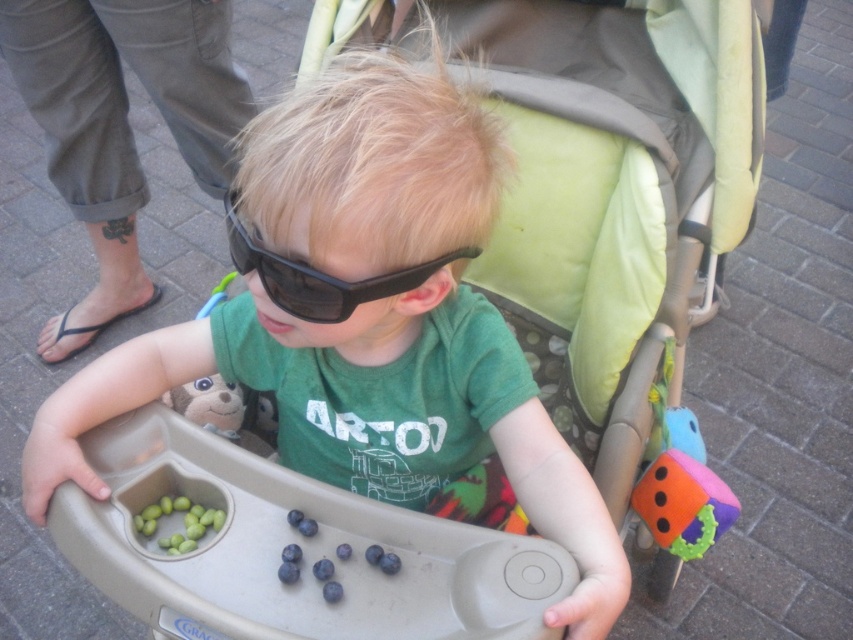
You are a parent trying to place a new toy in the stroller. The toy requires a space wider than the black matte sunglasses at center. Can the green fabric baby carriage at center provide enough width for it?

The green fabric baby carriage at center might be wider than black matte sunglasses at center, so it could potentially provide enough width for the toy.

The child in the stroller is looking at two items. One is the matte black sunglasses at center and the other is the green matte grapes at lower left. Which item is closer to the child?

The matte black sunglasses at center is in front of the green matte grapes at lower left, so the matte black sunglasses at center is closer to the child.

You are a parent trying to ensure your child can see over the green fabric baby carriage at center while pushing them. Considering the black matte sunglasses at center, will the child be able to look over the carriage without adjusting their position?

The green fabric baby carriage at center is taller than the black matte sunglasses at center. Since the sunglasses are on the child, the carriage height might block their view unless they tilt their head back, but the sunglasses could limit upward visibility. However, the exact obstruction depends on the child and carriage angle.